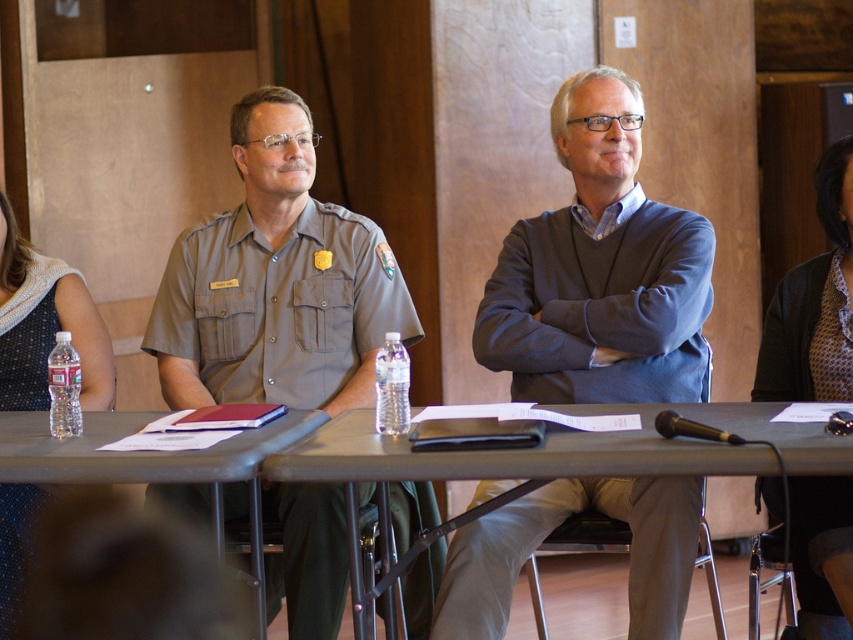
Question: Is matte khaki uniform at center wider than patterned fabric shirt at right?

Choices:
 (A) yes
 (B) no

Answer: (A)

Question: Which of the following is the farthest from the observer?

Choices:
 (A) clear plastic water bottle at left
 (B) metallic gray table at center
 (C) patterned fabric shirt at right

Answer: (C)

Question: Does metallic gray table at center appear on the left side of blue textured dress at left?

Choices:
 (A) yes
 (B) no

Answer: (B)

Question: Which object is farther from the camera taking this photo?

Choices:
 (A) gray sweater at center
 (B) metallic gray table at center
 (C) patterned fabric shirt at right
 (D) clear plastic water bottle at left

Answer: (A)

Question: Which object appears farthest from the camera in this image?

Choices:
 (A) gray sweater at center
 (B) patterned fabric shirt at right

Answer: (A)

Question: Is metallic gray table at center bigger than blue textured dress at left?

Choices:
 (A) no
 (B) yes

Answer: (B)